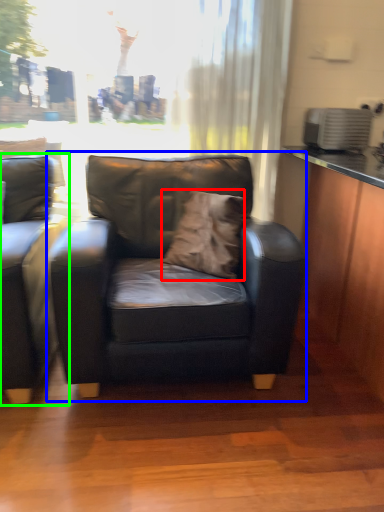
Question: Based on their relative distances, which object is nearer to pillow (highlighted by a red box)? Choose from chair (highlighted by a blue box) and studio couch (highlighted by a green box).

Choices:
 (A) chair
 (B) studio couch

Answer: (A)